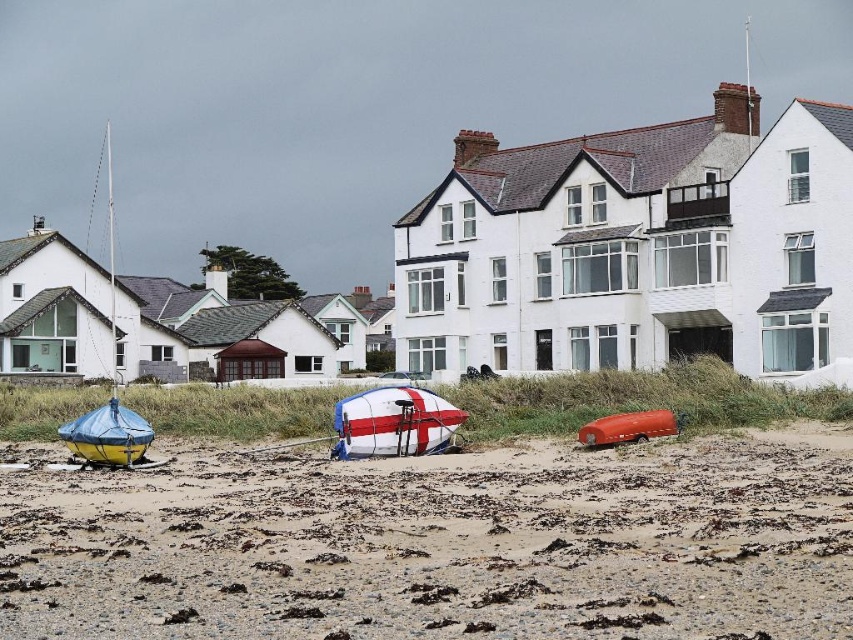
Question: Which object is positioned closest to the white and red striped boat at center?

Choices:
 (A) brown sandy beach at lower center
 (B) matte orange car at center
 (C) yellow rubber boat at left

Answer: (B)

Question: Estimate the real-world distances between objects in this image. Which object is farther from the yellow rubber boat at left?

Choices:
 (A) matte orange car at center
 (B) white and red striped boat at center
 (C) brown sandy beach at lower center

Answer: (A)

Question: Is white and red striped boat at center wider than yellow rubber boat at left?

Choices:
 (A) no
 (B) yes

Answer: (A)

Question: Is brown sandy beach at lower center positioned before yellow rubber boat at left?

Choices:
 (A) no
 (B) yes

Answer: (B)

Question: Can you confirm if white and red striped boat at center is positioned to the right of yellow rubber boat at left?

Choices:
 (A) no
 (B) yes

Answer: (B)

Question: Which point is farther to the camera?

Choices:
 (A) brown sandy beach at lower center
 (B) yellow rubber boat at left
 (C) matte orange car at center

Answer: (B)